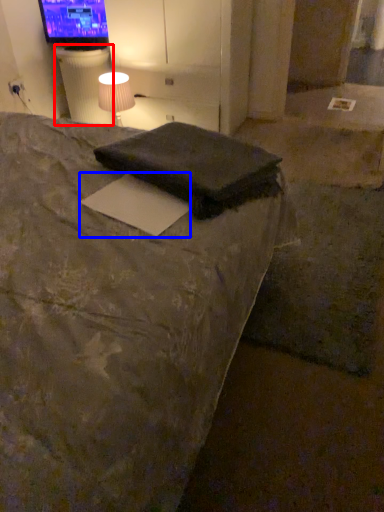
Question: Which object appears closest to the camera in this image, table (highlighted by a red box) or paper (highlighted by a blue box)?

Choices:
 (A) table
 (B) paper

Answer: (B)